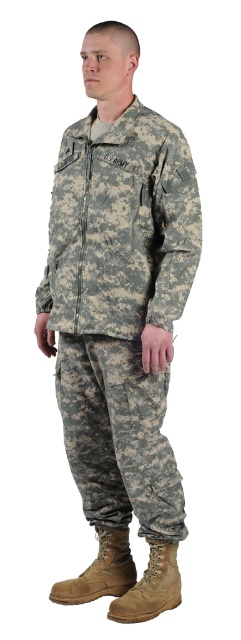
You are a photographer trying to capture a closeup shot of the U.S. ARMY patch on the soldier. You have two points marked on the uniform to focus on. Point A is at coordinates point [125,595] and Point B is at point [107,593]. Which point should you focus on to ensure the U.S. ARMY patch is in clear view?

Point A at coordinates point [125,595] is closer to the viewer than point [107,593], so focusing on Point A will ensure the U.S. ARMY patch is in clear view.

You are a tailor trying to repair the camouflage fabric uniform at center and the tan suede boot at lower right. Which item is positioned closer to the right side of the image?

The camouflage fabric uniform at center is positioned to the right of the tan suede boot at lower right, so the camouflage fabric uniform at center is closer to the right side of the image.

You are a photographer setting up a shoot with a person wearing tan suede boots. You need to position a small prop between their boots. Based on the image, where should you place the prop so it is between the tan suede boot at lower center and the tan suede boot at lower right?

You should place the prop between the tan suede boot at lower center and the tan suede boot at lower right, positioning it below the tan suede boot at lower center since it is above the tan suede boot at lower right.